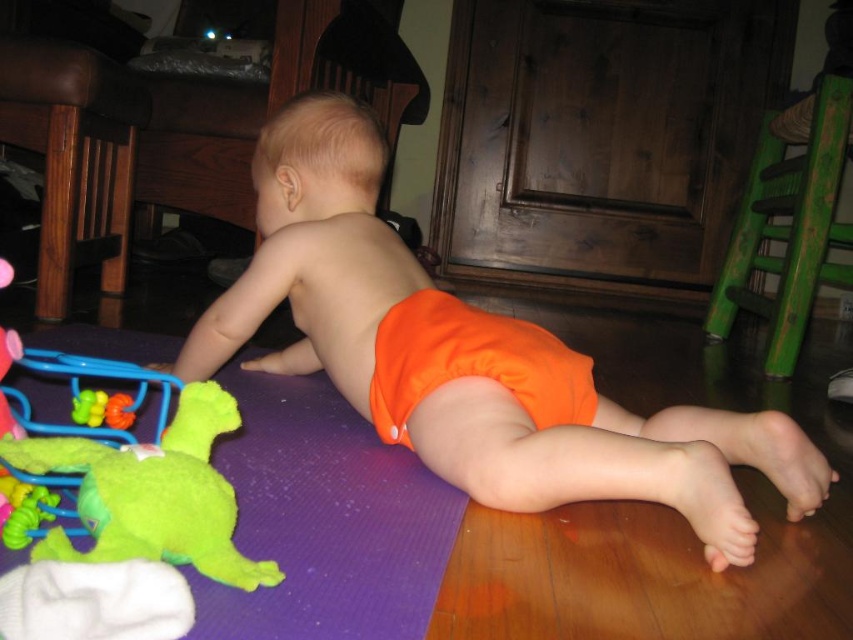
Is point (784, 456) closer to viewer compared to point (193, 433)?

No, it is behind (193, 433).

Can you confirm if orange fabric diaper at center is positioned above green fuzzy toy at lower left?

Yes.

Image resolution: width=853 pixels, height=640 pixels. Find the location of `orange fabric diaper at center`. orange fabric diaper at center is located at coordinates (469, 369).